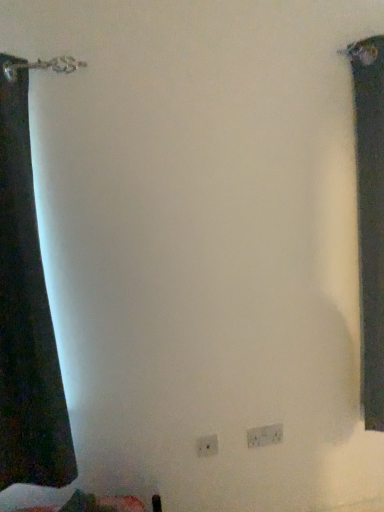
Question: Is white plastic electric outlet at lower center, which is counted as the first electric outlet, starting from the right, situated inside white plastic electric outlet at lower center, the first electric outlet from the front, or outside?

Choices:
 (A) outside
 (B) inside

Answer: (A)

Question: In terms of width, does white plastic electric outlet at lower center, which ranks as the 1th electric outlet in back-to-front order, look wider or thinner when compared to white plastic electric outlet at lower center, the second electric outlet in the right-to-left sequence?

Choices:
 (A) thin
 (B) wide

Answer: (B)

Question: Estimate the real-world distances between objects in this image. Which object is closer to the dark fabric curtain at right?

Choices:
 (A) white plastic electric outlet at lower center, the second electric outlet in the right-to-left sequence
 (B) white plastic electric outlet at lower center, placed as the 2th electric outlet when sorted from left to right

Answer: (B)

Question: Estimate the real-world distances between objects in this image. Which object is farther from the white plastic electric outlet at lower center, which ranks as the 1th electric outlet in back-to-front order?

Choices:
 (A) dark fabric curtain at right
 (B) white plastic electric outlet at lower center, the second electric outlet in the right-to-left sequence

Answer: (A)